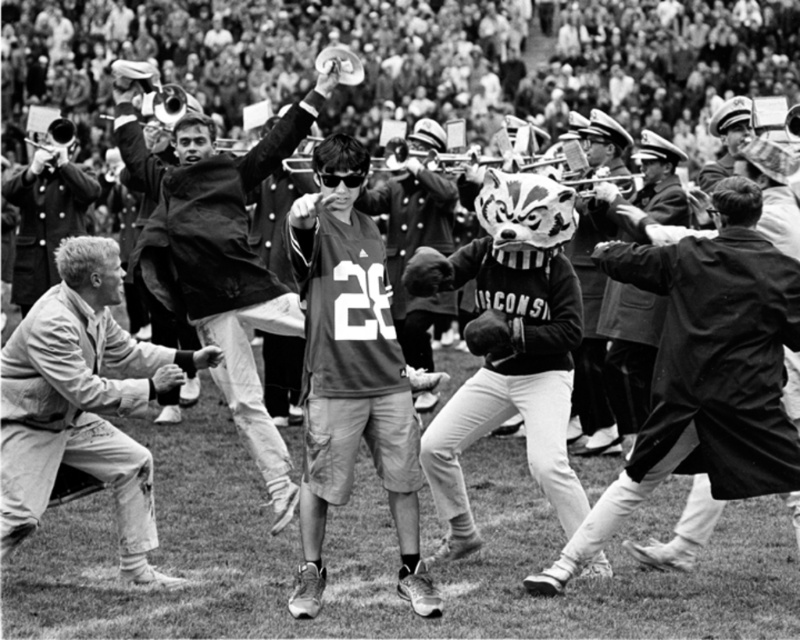
Question: Does black matte mascot at center come behind light beige cotton pants at lower left?

Choices:
 (A) yes
 (B) no

Answer: (A)

Question: Which of the following is the closest to the observer?

Choices:
 (A) smooth black coat at center
 (B) smooth leather jacket at left
 (C) light beige cotton pants at lower left
 (D) smooth leather jacket at center

Answer: (A)

Question: Considering the real-world distances, which object is farthest from the matte jersey at center?

Choices:
 (A) light beige cotton pants at lower left
 (B) black matte mascot at center

Answer: (A)

Question: Considering the real-world distances, which object is farthest from the light beige cotton pants at lower left?

Choices:
 (A) smooth leather jacket at left
 (B) matte jersey at center
 (C) matte black jersey at center

Answer: (A)

Question: Does smooth black coat at center appear over matte black jersey at center?

Choices:
 (A) no
 (B) yes

Answer: (A)

Question: Is black matte mascot at center to the left of light beige cotton pants at lower left from the viewer's perspective?

Choices:
 (A) no
 (B) yes

Answer: (A)